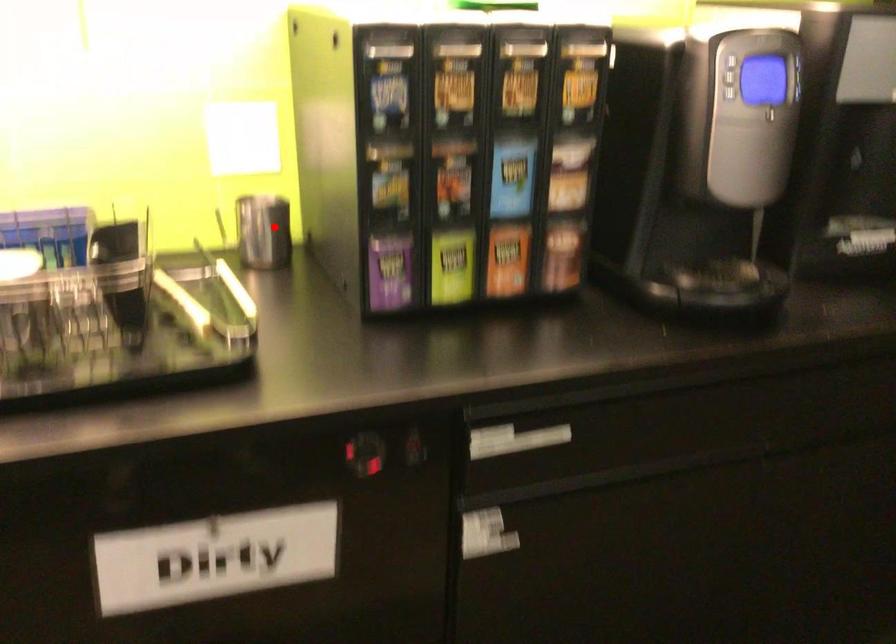
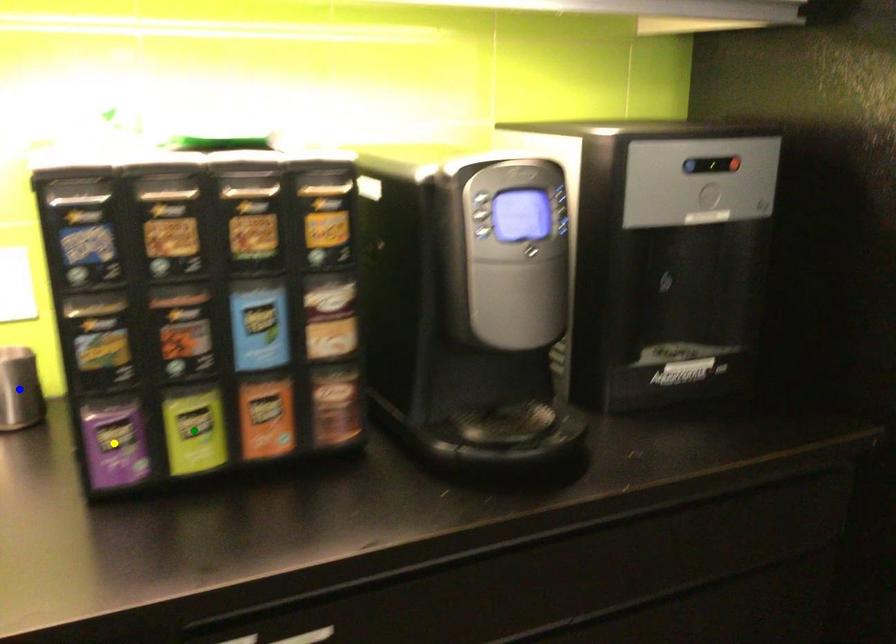
Question: I am providing you with two images of the same scene from different viewpoints. A red point is marked on the first image. You are given multiple points on the second image. In image 2, which mark is for the same physical point as the one in image 1?

Choices:
 (A) blue point
 (B) yellow point
 (C) green point

Answer: (A)